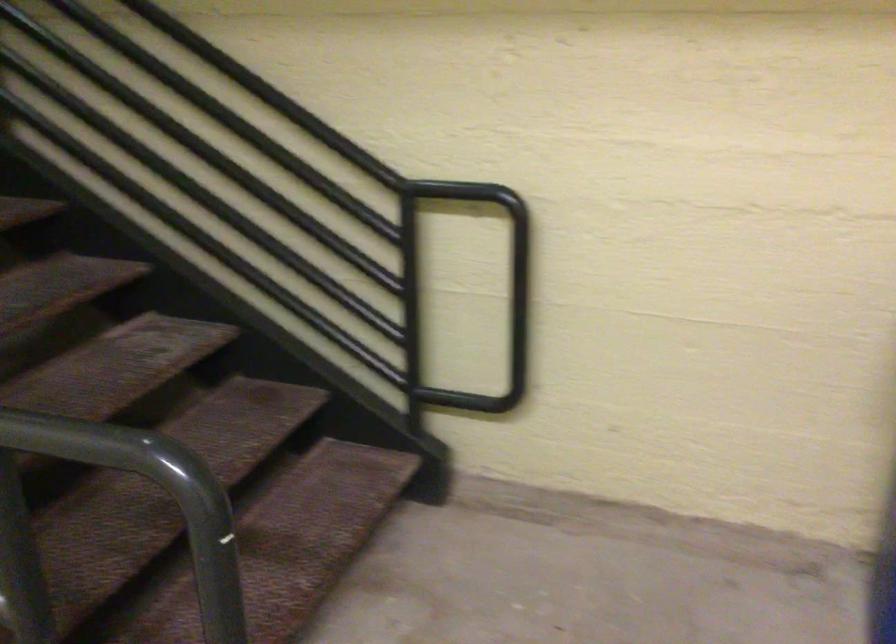
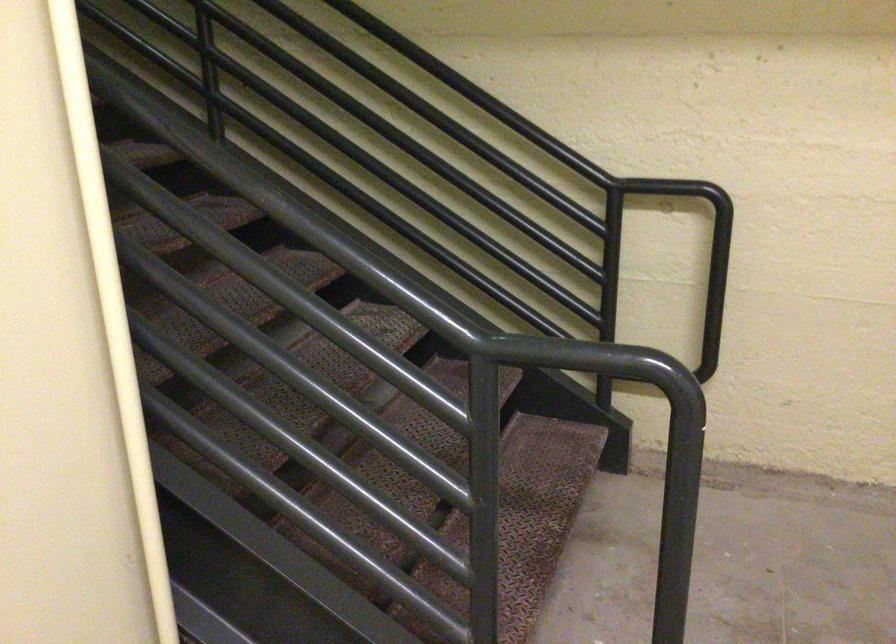
Where in the second image is the point corresponding to point 349,133 from the first image?

(546, 129)